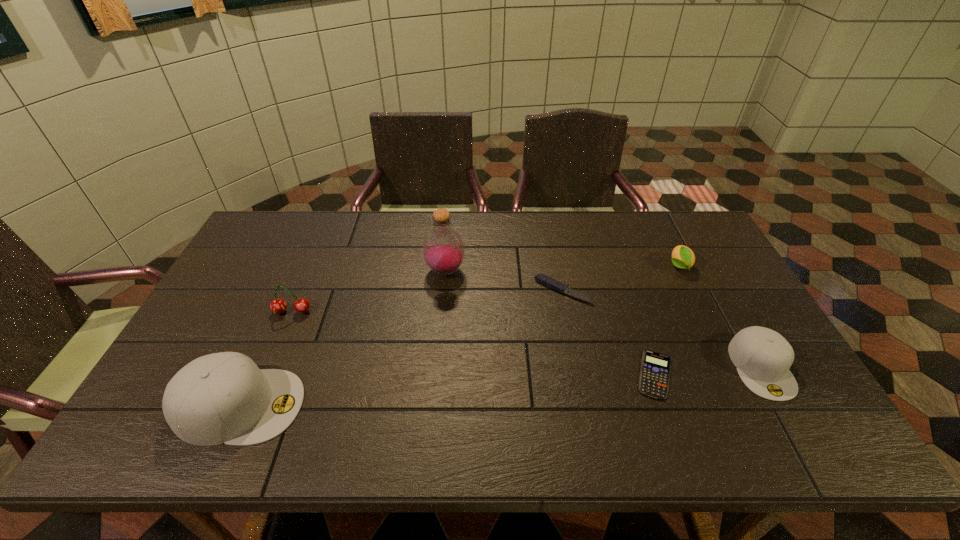
You are a GUI agent. You are given a task and a screenshot of the screen. Output one action in this format:
    pyautogui.click(x=<x>, y=<y>)
    Task: Click on the vacant space that's between the fourth object from left to right and the shortest object
    
    Given the screenshot: What is the action you would take?
    pyautogui.click(x=609, y=333)

What are the coordinates of `free point between the fifth tallest object and the right cap` in the screenshot? It's located at (720, 316).

This screenshot has width=960, height=540. Find the location of `free point between the sixth tallest object and the tallest object`. free point between the sixth tallest object and the tallest object is located at coordinates (504, 281).

Locate an element on the screen. vacant area between the fifth object from left to right and the bottle is located at coordinates (550, 323).

Image resolution: width=960 pixels, height=540 pixels. I want to click on vacant space that is in between the taller cap and the third object from left to right, so click(x=343, y=338).

Locate an element on the screen. empty location between the fifth tallest object and the bottle is located at coordinates (562, 268).

Locate an element on the screen. This screenshot has width=960, height=540. empty location between the right cap and the bottle is located at coordinates (603, 319).

Find the location of a particular element. Image resolution: width=960 pixels, height=540 pixels. unoccupied area between the shorter cap and the fifth tallest object is located at coordinates (720, 316).

The height and width of the screenshot is (540, 960). What are the coordinates of `object that is the second closest to the bottle` in the screenshot? It's located at (278, 305).

At what (x,y) coordinates should I click in order to perform the action: click on the sixth closest object to the third object from left to right. Please return your answer as a coordinate pair (x, y). The height and width of the screenshot is (540, 960). Looking at the image, I should click on (763, 357).